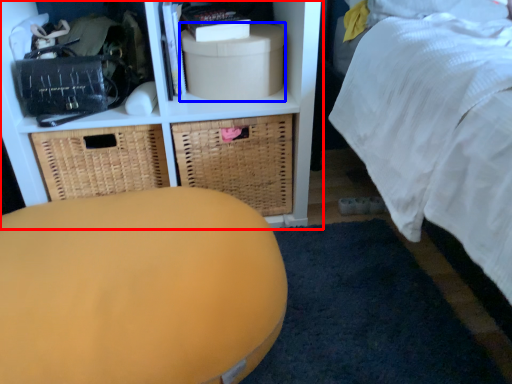
Question: Which object appears closest to the camera in this image, shelf (highlighted by a red box) or storage box (highlighted by a blue box)?

Choices:
 (A) shelf
 (B) storage box

Answer: (A)